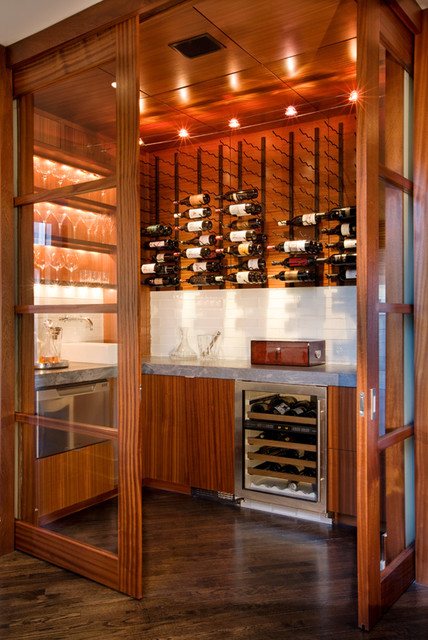
Identify the location of brown wooden floor. (247, 563).